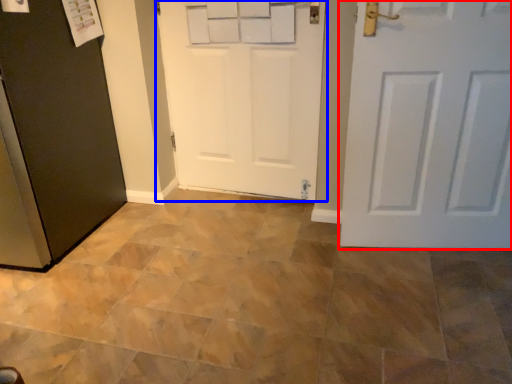
Question: Which point is further to the camera, door (highlighted by a red box) or door (highlighted by a blue box)?

Choices:
 (A) door
 (B) door

Answer: (B)